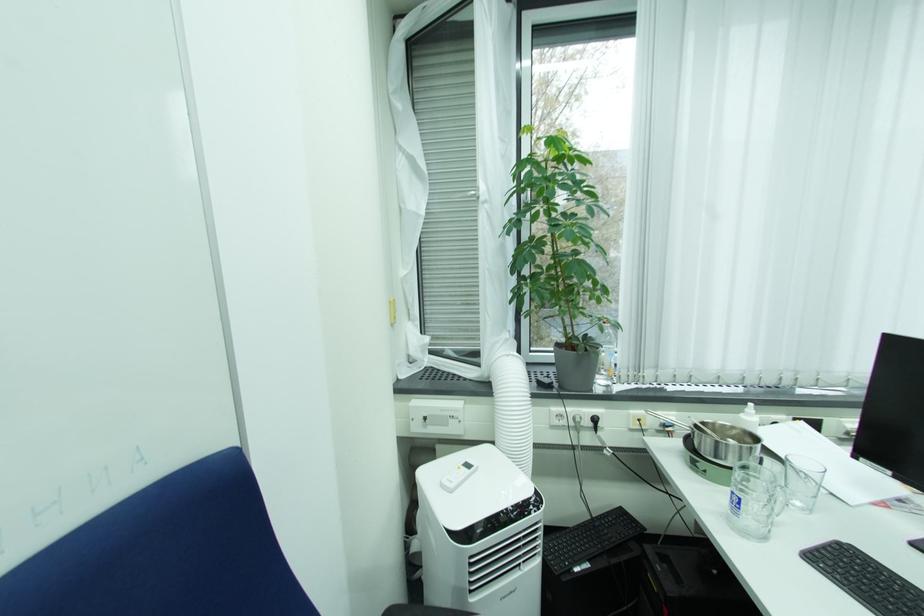
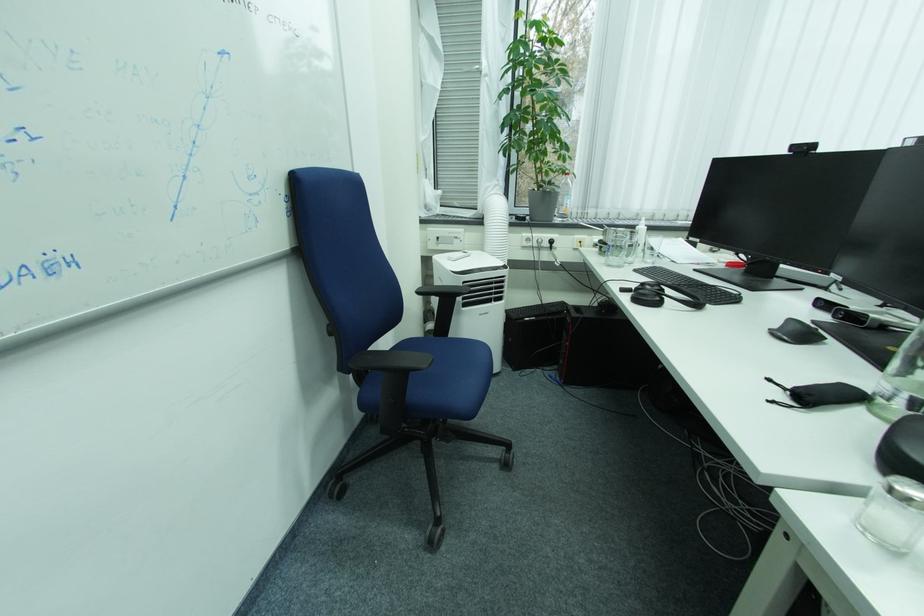
Question: The images are taken continuously from a first-person perspective. In which direction are you moving?

Choices:
 (A) Left
 (B) Right
 (C) Forward
 (D) Backward

Answer: (D)